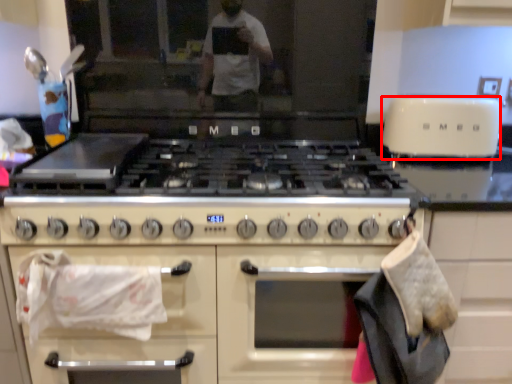
Question: From the image, what is the correct spatial relationship of toaster (annotated by the red box) in relation to cabinetry?

Choices:
 (A) right
 (B) left

Answer: (A)